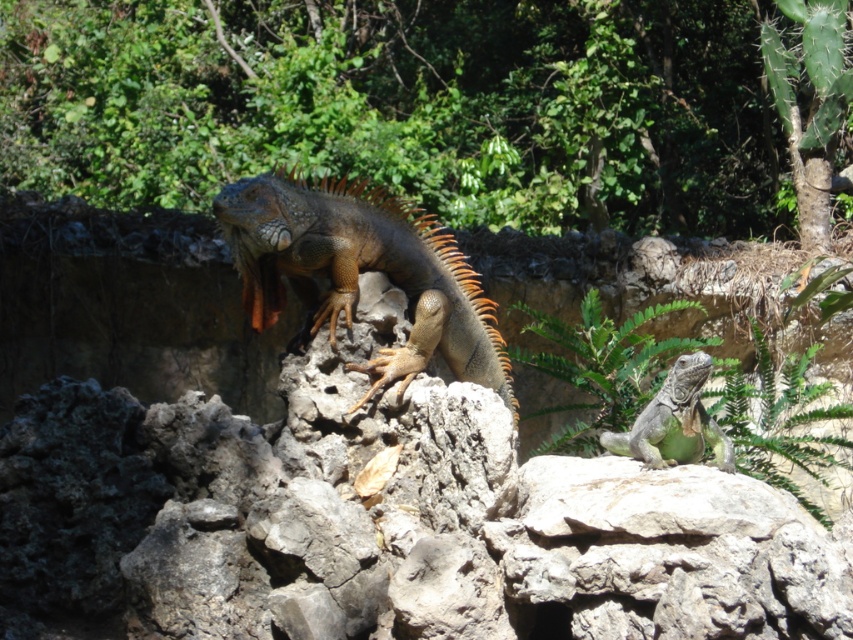
Question: Does shiny brown iguana at center come in front of green scaly lizard at center?

Choices:
 (A) yes
 (B) no

Answer: (B)

Question: Does shiny brown iguana at center have a lesser width compared to green scaly lizard at center?

Choices:
 (A) no
 (B) yes

Answer: (A)

Question: Does shiny brown iguana at center appear over green scaly lizard at center?

Choices:
 (A) yes
 (B) no

Answer: (A)

Question: Which object appears closest to the camera in this image?

Choices:
 (A) green scaly lizard at center
 (B) shiny brown iguana at center

Answer: (A)

Question: Which of the following is the closest to the observer?

Choices:
 (A) (426, 269)
 (B) (695, 380)

Answer: (B)